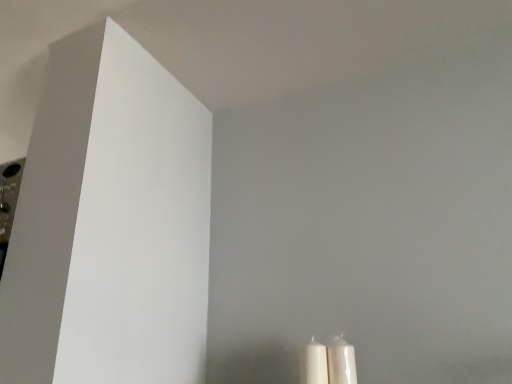
Question: Considering the relative sizes of white glossy candle at lower right, which ranks as the second candle in left-to-right order, and white matte candle at lower right, the 2th candle when ordered from right to left, in the image provided, is white glossy candle at lower right, which ranks as the second candle in left-to-right order, smaller than white matte candle at lower right, the 2th candle when ordered from right to left,?

Choices:
 (A) no
 (B) yes

Answer: (B)

Question: Does white glossy candle at lower right, positioned as the first candle in right-to-left order, contain white matte candle at lower right, the 2th candle when ordered from right to left?

Choices:
 (A) no
 (B) yes

Answer: (A)

Question: From a real-world perspective, is white glossy candle at lower right, which ranks as the second candle in left-to-right order, beneath white matte candle at lower right, which ranks as the first candle in left-to-right order?

Choices:
 (A) no
 (B) yes

Answer: (B)

Question: Is white glossy candle at lower right, which ranks as the second candle in left-to-right order, positioned behind white matte candle at lower right, which ranks as the first candle in left-to-right order?

Choices:
 (A) yes
 (B) no

Answer: (A)

Question: From the image's perspective, would you say white glossy candle at lower right, which ranks as the second candle in left-to-right order, is positioned over white matte candle at lower right, the 2th candle when ordered from right to left?

Choices:
 (A) no
 (B) yes

Answer: (B)

Question: Is white glossy candle at lower right, positioned as the first candle in right-to-left order, outside of white matte candle at lower right, the 2th candle when ordered from right to left?

Choices:
 (A) yes
 (B) no

Answer: (A)

Question: Is white matte candle at lower right, which ranks as the first candle in left-to-right order, aimed at white glossy candle at lower right, which ranks as the second candle in left-to-right order?

Choices:
 (A) no
 (B) yes

Answer: (A)

Question: Is white matte candle at lower right, which ranks as the first candle in left-to-right order, shorter than white glossy candle at lower right, positioned as the first candle in right-to-left order?

Choices:
 (A) no
 (B) yes

Answer: (A)

Question: Is white matte candle at lower right, the 2th candle when ordered from right to left, located outside white glossy candle at lower right, positioned as the first candle in right-to-left order?

Choices:
 (A) yes
 (B) no

Answer: (A)

Question: Considering the relative sizes of white matte candle at lower right, which ranks as the first candle in left-to-right order, and white glossy candle at lower right, which ranks as the second candle in left-to-right order, in the image provided, is white matte candle at lower right, which ranks as the first candle in left-to-right order, thinner than white glossy candle at lower right, which ranks as the second candle in left-to-right order,?

Choices:
 (A) no
 (B) yes

Answer: (A)

Question: Is white matte candle at lower right, which ranks as the first candle in left-to-right order, in contact with white glossy candle at lower right, positioned as the first candle in right-to-left order?

Choices:
 (A) yes
 (B) no

Answer: (A)

Question: Is white glossy candle at lower right, which ranks as the second candle in left-to-right order, surrounded by white matte candle at lower right, which ranks as the first candle in left-to-right order?

Choices:
 (A) no
 (B) yes

Answer: (A)

Question: From the image's perspective, is white matte candle at lower right, the 2th candle when ordered from right to left, located above or below white glossy candle at lower right, which ranks as the second candle in left-to-right order?

Choices:
 (A) above
 (B) below

Answer: (B)